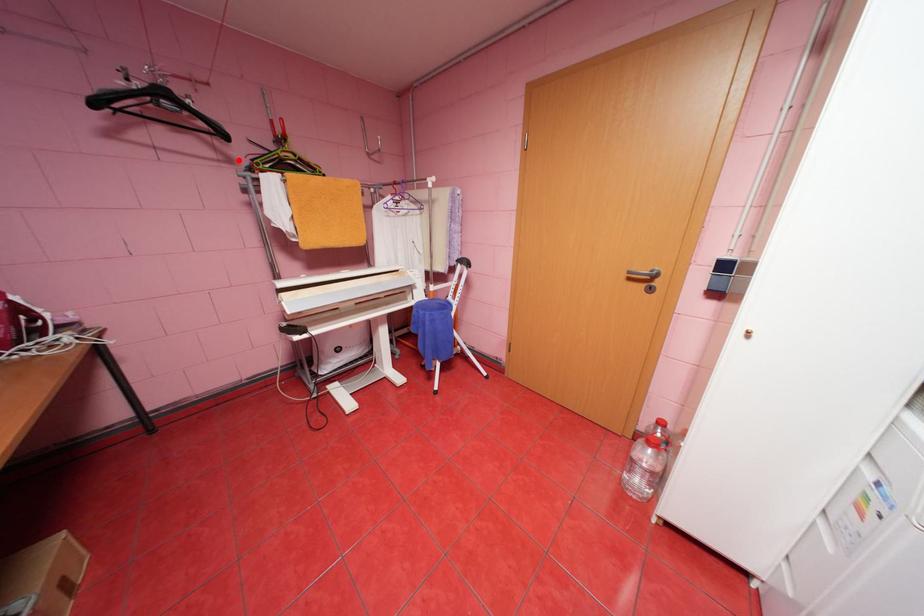
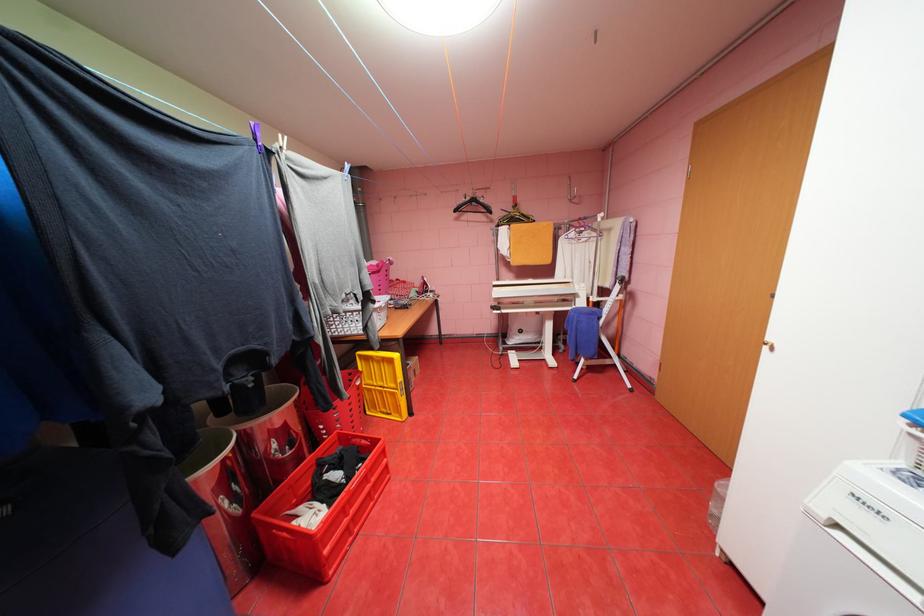
Find the pixel in the second image that matches the highlighted location in the first image.

(500, 221)